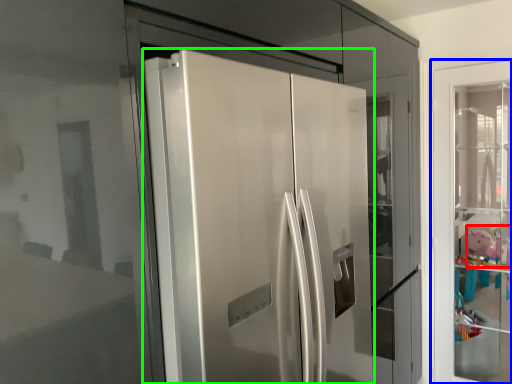
Question: Based on their relative distances, which object is farther from toy (highlighted by a red box)? Choose from door (highlighted by a blue box) and door (highlighted by a green box).

Choices:
 (A) door
 (B) door

Answer: (B)